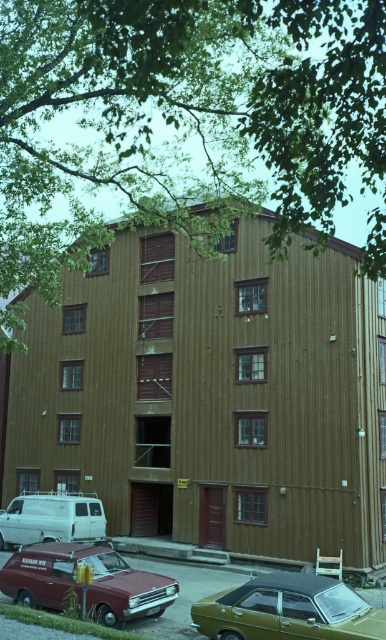
Which is above, metallic gold car at lower center or white matte van at lower left?

metallic gold car at lower center

Locate an element on the screen. This screenshot has width=386, height=640. metallic gold car at lower center is located at coordinates (289, 611).

Does point (91, 330) come farther from viewer compared to point (16, 512)?

Yes, it is behind point (16, 512).

From the picture: Can you confirm if wooden building at center is positioned below white matte van at lower left?

Incorrect, wooden building at center is not positioned below white matte van at lower left.

Describe the element at coordinates (211, 396) in the screenshot. Image resolution: width=386 pixels, height=640 pixels. I see `wooden building at center` at that location.

The image size is (386, 640). Find the location of `wooden building at center`. wooden building at center is located at coordinates (211, 396).

Is wooden building at center behind metallic gold car at lower center?

Yes, wooden building at center is further from the viewer.

Does wooden building at center appear on the left side of metallic gold car at lower center?

Indeed, wooden building at center is positioned on the left side of metallic gold car at lower center.

Where is `wooden building at center`? This screenshot has height=640, width=386. wooden building at center is located at coordinates (211, 396).

Locate an element on the screen. The width and height of the screenshot is (386, 640). wooden building at center is located at coordinates (211, 396).